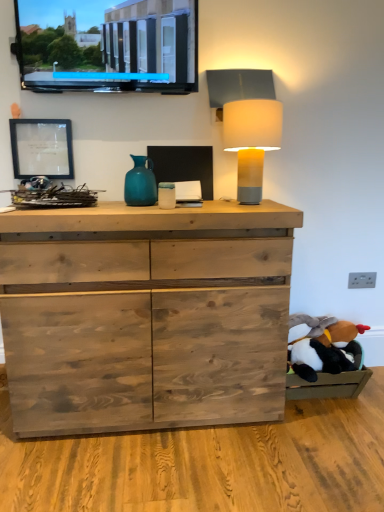
Image resolution: width=384 pixels, height=512 pixels. In order to click on vacant area situated below matte yellow lampshade at upper right (from a real-world perspective) in this screenshot , I will do `click(249, 202)`.